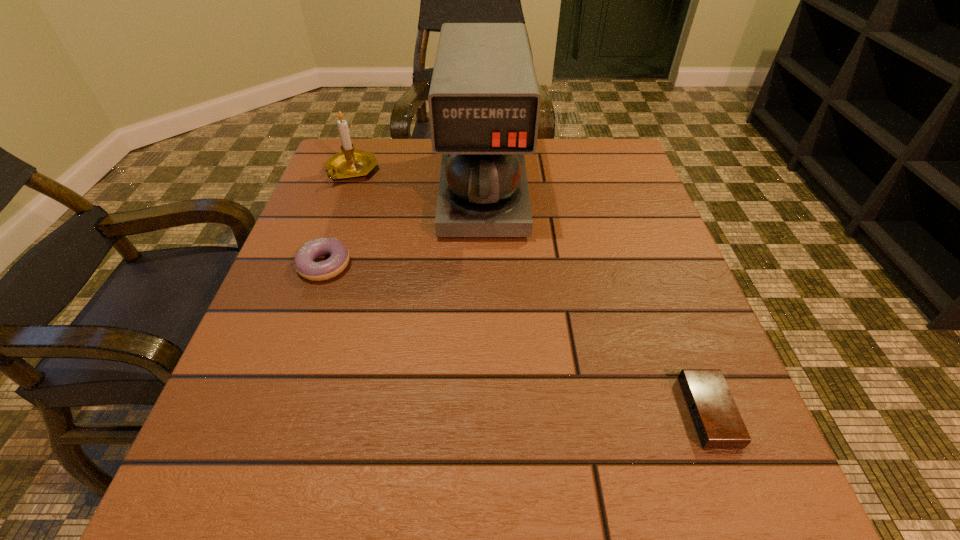
In order to click on coffee maker in this screenshot , I will do `click(484, 101)`.

Locate an element on the screen. The height and width of the screenshot is (540, 960). the tallest object is located at coordinates (484, 101).

This screenshot has width=960, height=540. In order to click on the second tallest object in this screenshot , I will do `click(350, 163)`.

Where is `doughnut`? doughnut is located at coordinates (304, 264).

Locate an element on the screen. The height and width of the screenshot is (540, 960). the second shortest object is located at coordinates (304, 264).

In order to click on the rightmost object in this screenshot , I will do `click(715, 416)`.

Where is `the nearest object`? This screenshot has width=960, height=540. the nearest object is located at coordinates (715, 416).

Find the location of a particular element. blank space located 0.400m on the carafe side of the coffee maker is located at coordinates (485, 433).

Image resolution: width=960 pixels, height=540 pixels. I want to click on vacant space located on the right of the second tallest object, so click(453, 171).

This screenshot has height=540, width=960. What are the coordinates of `free spot located on the right of the third tallest object` in the screenshot? It's located at (556, 265).